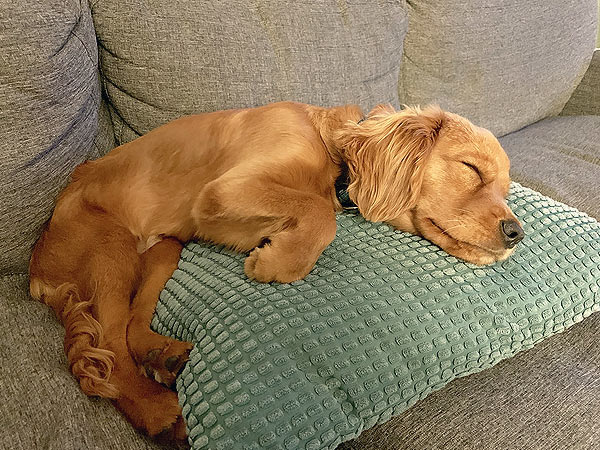
Where is `cushion`? The image size is (600, 450). cushion is located at coordinates (540, 426), (62, 396).